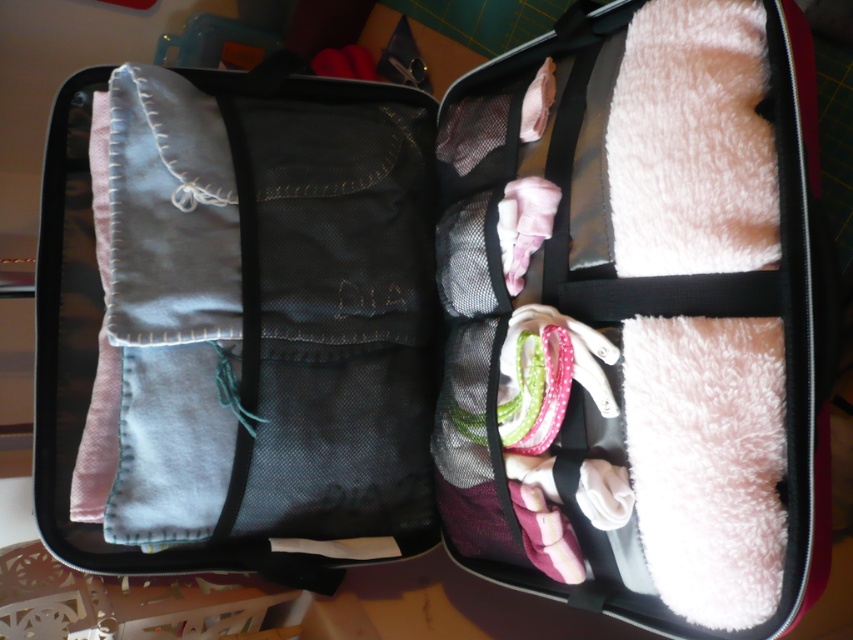
Question: Does white fluffy towel at upper right have a greater width compared to denim fabric pants at left?

Choices:
 (A) no
 (B) yes

Answer: (A)

Question: Is white fluffy towel at upper right positioned before denim fabric pants at left?

Choices:
 (A) yes
 (B) no

Answer: (A)

Question: Which point appears closest to the camera in this image?

Choices:
 (A) (584, 458)
 (B) (276, 548)

Answer: (A)

Question: Which object appears closest to the camera in this image?

Choices:
 (A) denim fabric pants at left
 (B) white fluffy towel at upper right

Answer: (B)

Question: Where is white fluffy towel at upper right located in relation to denim fabric pants at left in the image?

Choices:
 (A) below
 (B) above

Answer: (B)